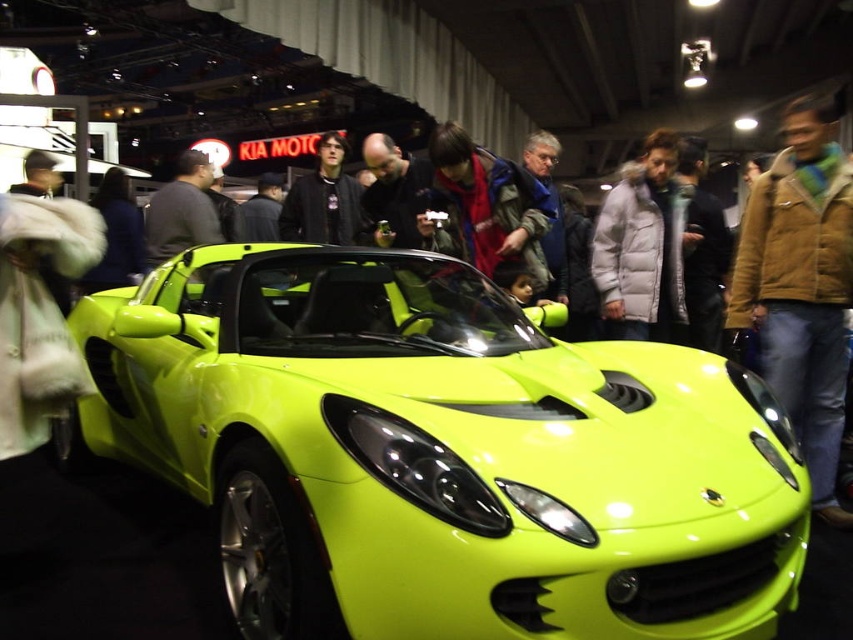
Question: Is lime green matte sports car at center above brown leather jacket at right?

Choices:
 (A) yes
 (B) no

Answer: (B)

Question: Estimate the real-world distances between objects in this image. Which object is closer to the lime green matte sports car at center?

Choices:
 (A) brown leather jacket at right
 (B) dark gray sweater at center

Answer: (A)

Question: Can you confirm if brown leather jacket at right is positioned to the right of dark gray sweater at center?

Choices:
 (A) no
 (B) yes

Answer: (B)

Question: Which point appears closest to the camera in this image?

Choices:
 (A) (770, 212)
 (B) (202, 166)

Answer: (A)

Question: Which of the following is the farthest from the observer?

Choices:
 (A) (184, 244)
 (B) (833, 184)

Answer: (A)

Question: From the image, what is the correct spatial relationship of brown leather jacket at right in relation to dark gray sweater at center?

Choices:
 (A) above
 (B) below

Answer: (B)